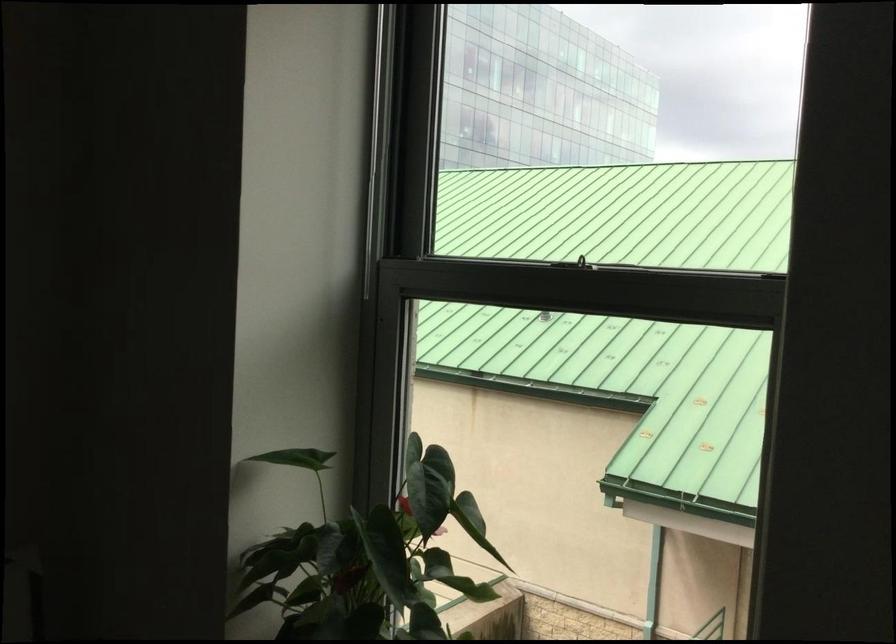
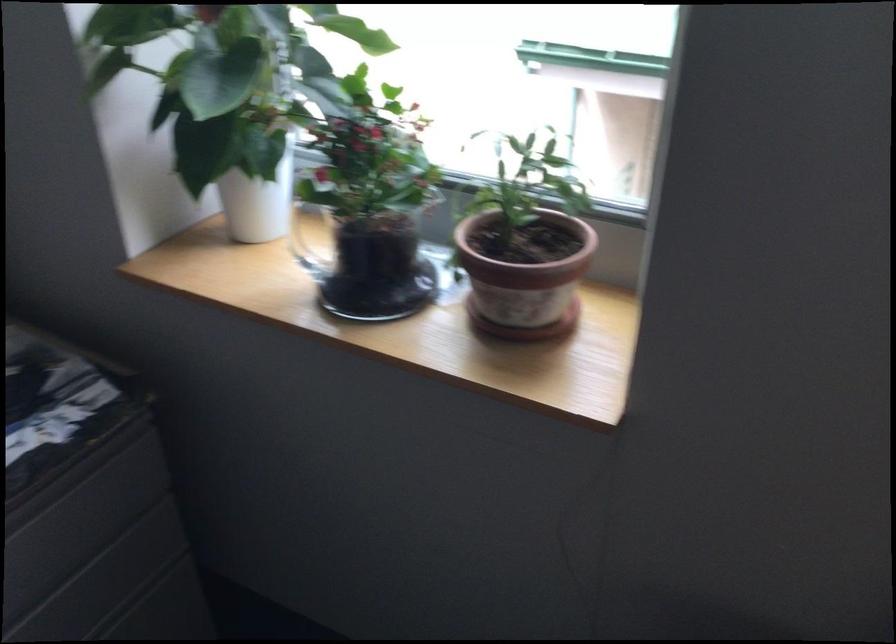
Question: The first image is from the beginning of the video and the second image is from the end. How did the camera likely rotate when shooting the video?

Choices:
 (A) Left
 (B) Right
 (C) Up
 (D) Down

Answer: (D)